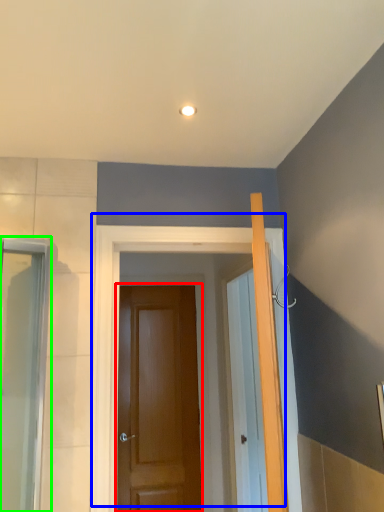
Question: Which object is the closest to the door (highlighted by a red box)? Choose among these: door (highlighted by a blue box) or screen door (highlighted by a green box).

Choices:
 (A) door
 (B) screen door

Answer: (A)